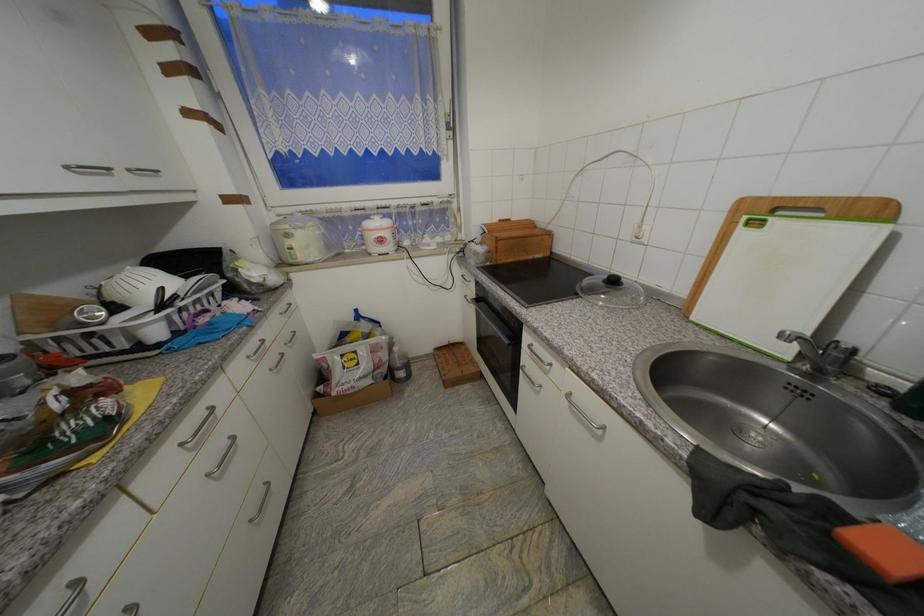
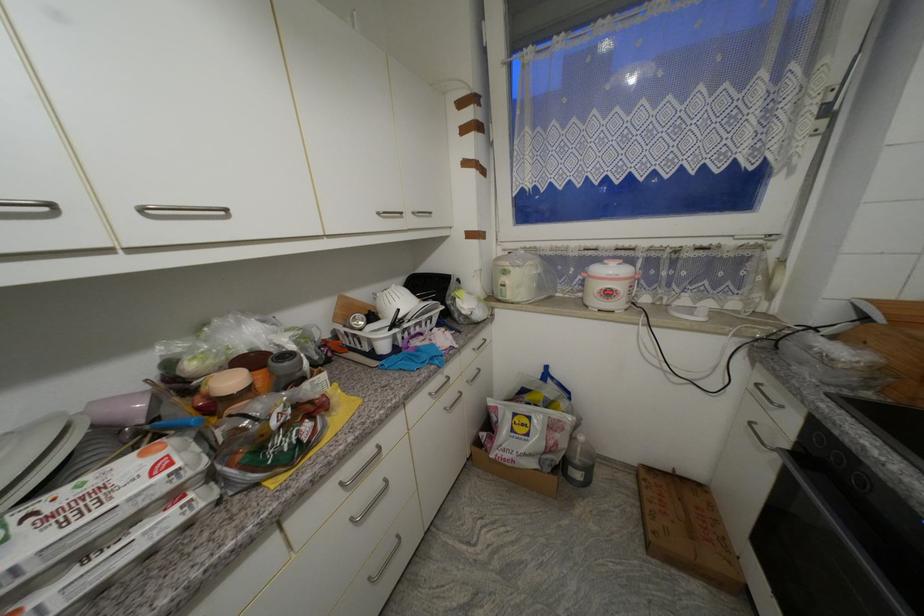
The point at (294,237) is marked in the first image. Where is the corresponding point in the second image?

(511, 274)